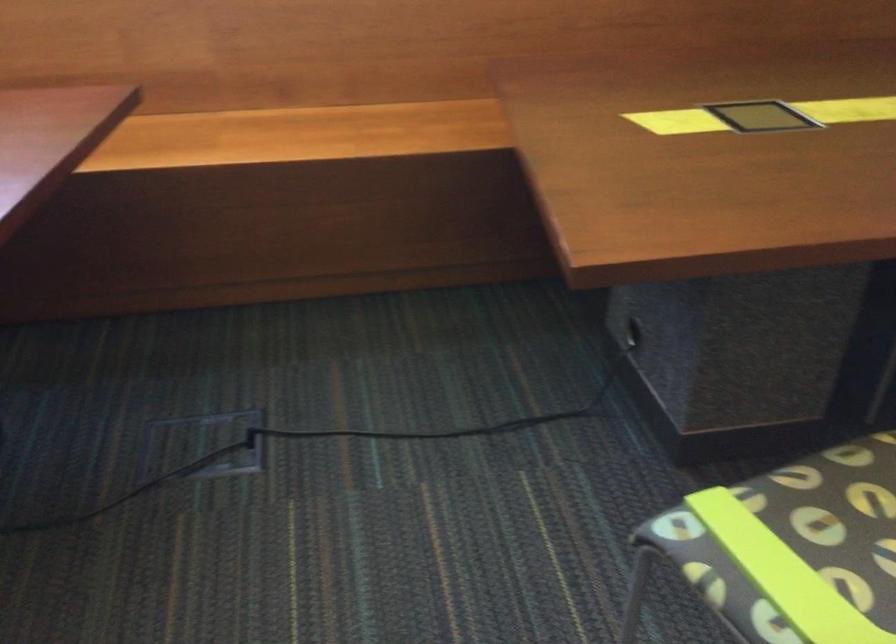
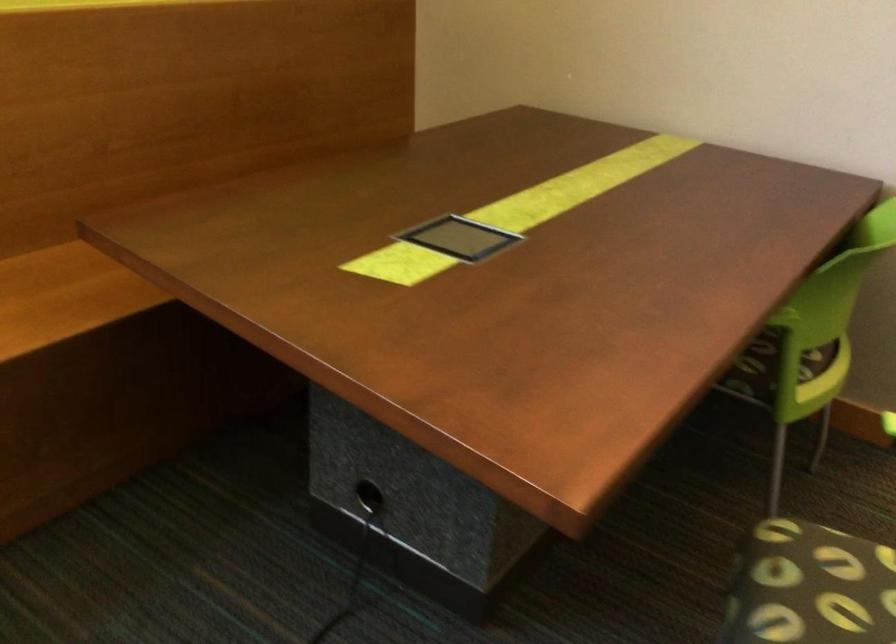
Question: The first image is from the beginning of the video and the second image is from the end. How did the camera likely rotate when shooting the video?

Choices:
 (A) Left
 (B) Right
 (C) Up
 (D) Down

Answer: (B)